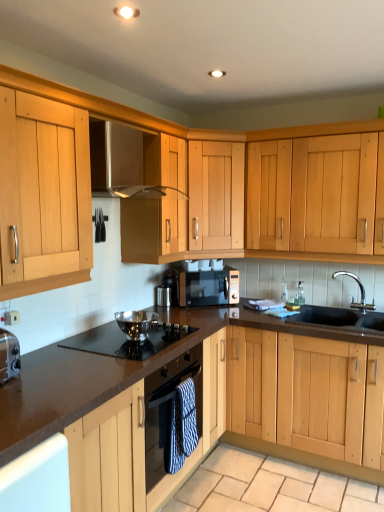
Question: Considering the relative sizes of polished stainless steel bowl at center and matte black microwave at center in the image provided, is polished stainless steel bowl at center taller than matte black microwave at center?

Choices:
 (A) no
 (B) yes

Answer: (A)

Question: Does polished stainless steel bowl at center appear on the right side of matte black microwave at center?

Choices:
 (A) no
 (B) yes

Answer: (A)

Question: Is polished stainless steel bowl at center aimed at matte black microwave at center?

Choices:
 (A) yes
 (B) no

Answer: (B)

Question: Is polished stainless steel bowl at center beside matte black microwave at center?

Choices:
 (A) yes
 (B) no

Answer: (B)

Question: Does polished stainless steel bowl at center have a lesser height compared to matte black microwave at center?

Choices:
 (A) no
 (B) yes

Answer: (B)

Question: Relative to polished stainless steel gas stove at center, is brown laminate countertop at center in front or behind?

Choices:
 (A) front
 (B) behind

Answer: (A)

Question: Considering the positions of brown laminate countertop at center and polished stainless steel gas stove at center in the image, is brown laminate countertop at center taller or shorter than polished stainless steel gas stove at center?

Choices:
 (A) tall
 (B) short

Answer: (A)

Question: From the image's perspective, is brown laminate countertop at center above or below polished stainless steel gas stove at center?

Choices:
 (A) below
 (B) above

Answer: (A)

Question: Is brown laminate countertop at center to the left or to the right of polished stainless steel gas stove at center in the image?

Choices:
 (A) left
 (B) right

Answer: (A)

Question: From the image's perspective, is polished stainless steel bowl at center located above or below brown laminate countertop at center?

Choices:
 (A) below
 (B) above

Answer: (B)

Question: Would you say polished stainless steel bowl at center is to the left or to the right of brown laminate countertop at center in the picture?

Choices:
 (A) right
 (B) left

Answer: (A)

Question: From a real-world perspective, is polished stainless steel bowl at center positioned above or below brown laminate countertop at center?

Choices:
 (A) below
 (B) above

Answer: (B)

Question: In terms of height, does polished stainless steel bowl at center look taller or shorter compared to brown laminate countertop at center?

Choices:
 (A) tall
 (B) short

Answer: (B)

Question: In the image, is matte black microwave at center on the left side or the right side of satin stainless steel exhaust hood at upper center?

Choices:
 (A) left
 (B) right

Answer: (B)

Question: Based on their sizes in the image, would you say matte black microwave at center is bigger or smaller than satin stainless steel exhaust hood at upper center?

Choices:
 (A) big
 (B) small

Answer: (B)